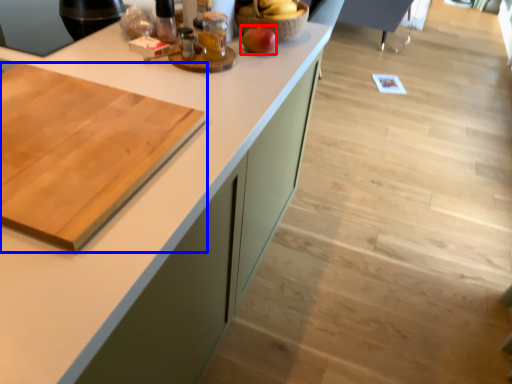
Question: Among these objects, which one is farthest to the camera, apple (highlighted by a red box) or cutting board (highlighted by a blue box)?

Choices:
 (A) apple
 (B) cutting board

Answer: (A)